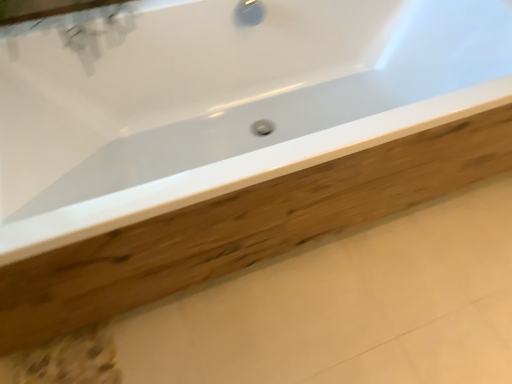
Question: Does point pyautogui.click(x=266, y=192) appear closer or farther from the camera than point pyautogui.click(x=3, y=89)?

Choices:
 (A) closer
 (B) farther

Answer: (A)

Question: In terms of width, does wooden plank at center look wider or thinner when compared to white glossy bathtub at center?

Choices:
 (A) thin
 (B) wide

Answer: (B)

Question: Is wooden plank at center to the left or to the right of white glossy bathtub at center in the image?

Choices:
 (A) left
 (B) right

Answer: (B)

Question: Is point (106, 94) positioned closer to the camera than point (185, 213)?

Choices:
 (A) farther
 (B) closer

Answer: (A)

Question: From a real-world perspective, relative to wooden plank at center, is white glossy bathtub at center vertically above or below?

Choices:
 (A) above
 (B) below

Answer: (A)

Question: Based on their sizes in the image, would you say white glossy bathtub at center is bigger or smaller than wooden plank at center?

Choices:
 (A) small
 (B) big

Answer: (B)

Question: Considering the relative positions of white glossy bathtub at center and wooden plank at center in the image provided, is white glossy bathtub at center to the left or to the right of wooden plank at center?

Choices:
 (A) right
 (B) left

Answer: (B)